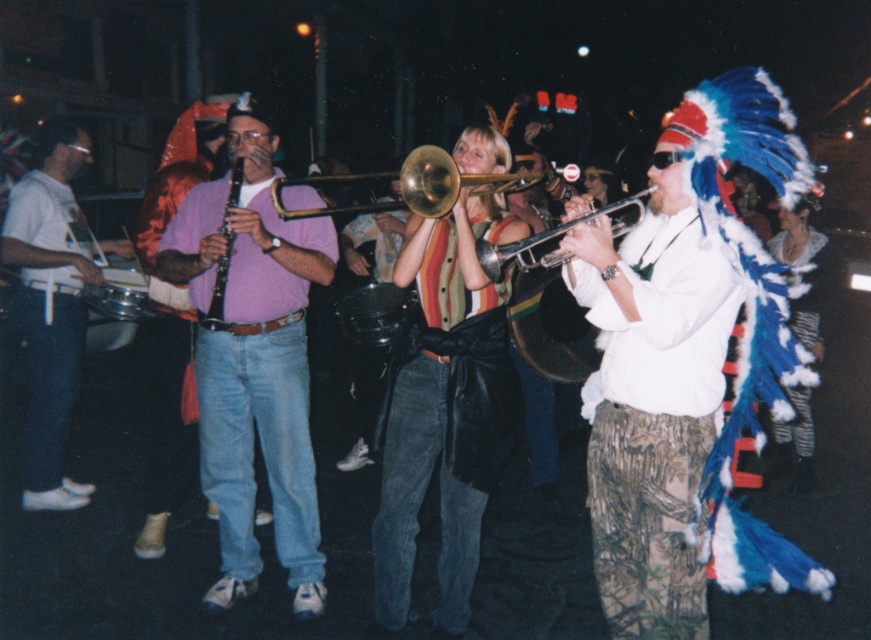
Does pink matte shirt at center appear on the left side of shiny black drum at center?

Indeed, pink matte shirt at center is positioned on the left side of shiny black drum at center.

Is point (307, 436) in front of point (565, 340)?

Yes, point (307, 436) is closer to viewer.

Find the location of a particular element. pink matte shirt at center is located at coordinates (253, 360).

Does camo-patterned pants at right have a lesser width compared to silver metallic trumpet at center?

Indeed, camo-patterned pants at right has a lesser width compared to silver metallic trumpet at center.

Is camo-patterned pants at right below silver metallic trumpet at center?

Yes.

Who is more forward, (x=663, y=422) or (x=545, y=230)?

Point (x=663, y=422) is in front.

Where is `camo-patterned pants at right`? The width and height of the screenshot is (871, 640). camo-patterned pants at right is located at coordinates (653, 419).

Can you confirm if shiny black drum at center is positioned above silver metallic trumpet at center?

Actually, shiny black drum at center is below silver metallic trumpet at center.

Which is above, shiny black drum at center or silver metallic trumpet at center?

silver metallic trumpet at center is above.

The height and width of the screenshot is (640, 871). In order to click on shiny black drum at center in this screenshot , I will do `click(550, 326)`.

Where is `shiny black drum at center`? shiny black drum at center is located at coordinates (550, 326).